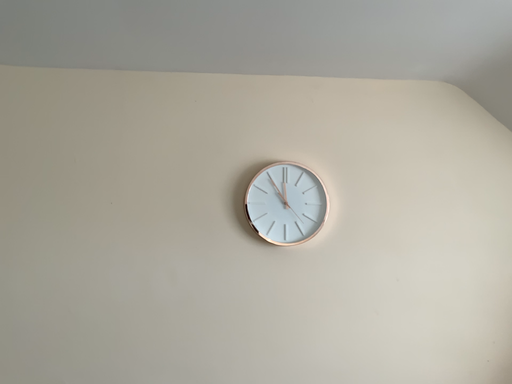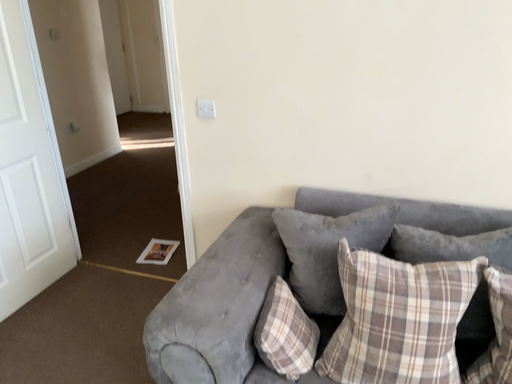
Question: How did the camera likely rotate when shooting the video?

Choices:
 (A) rotated downward
 (B) rotated upward

Answer: (A)